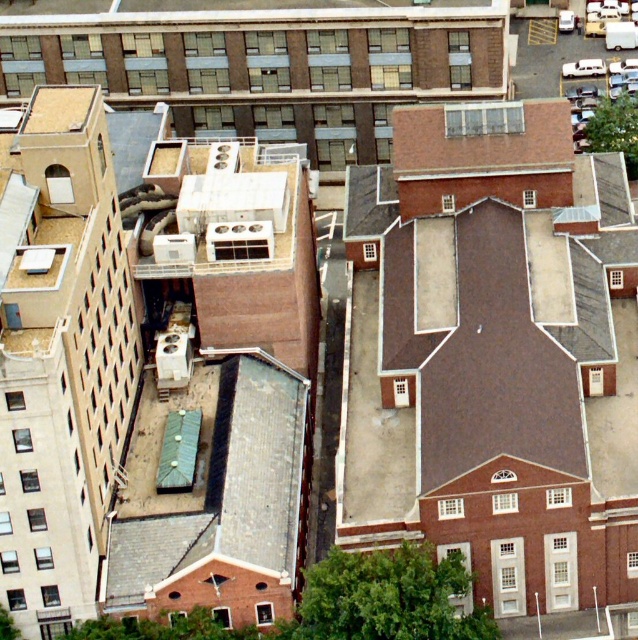
Which of these two, smooth concrete roof at upper center or brown textured roof at upper center, stands taller?

brown textured roof at upper center is taller.

Between point (186, 20) and point (531, 150), which one is positioned behind?

The point (186, 20) is more distant.

Image resolution: width=638 pixels, height=640 pixels. Find the location of `smooth concrete roof at upper center`. smooth concrete roof at upper center is located at coordinates (x=235, y=12).